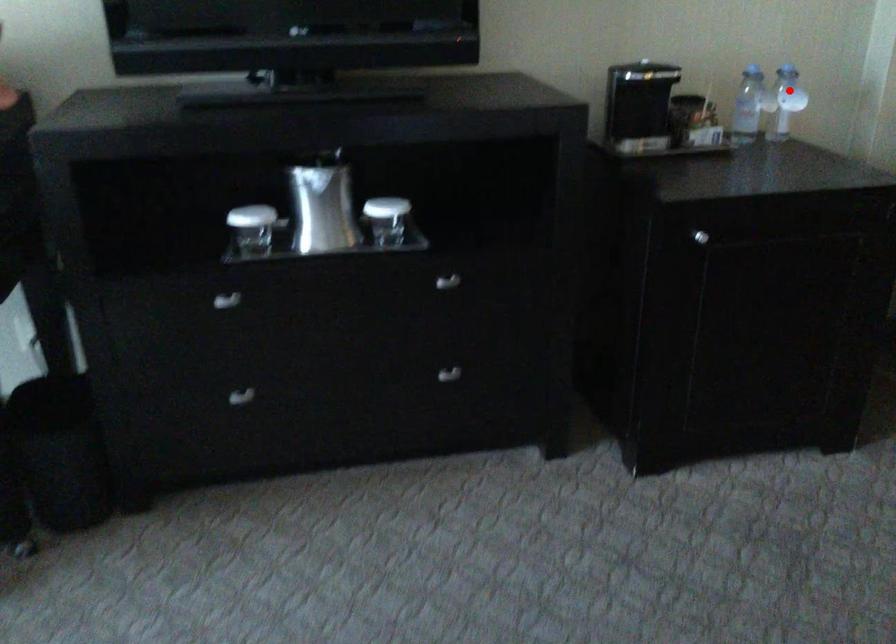
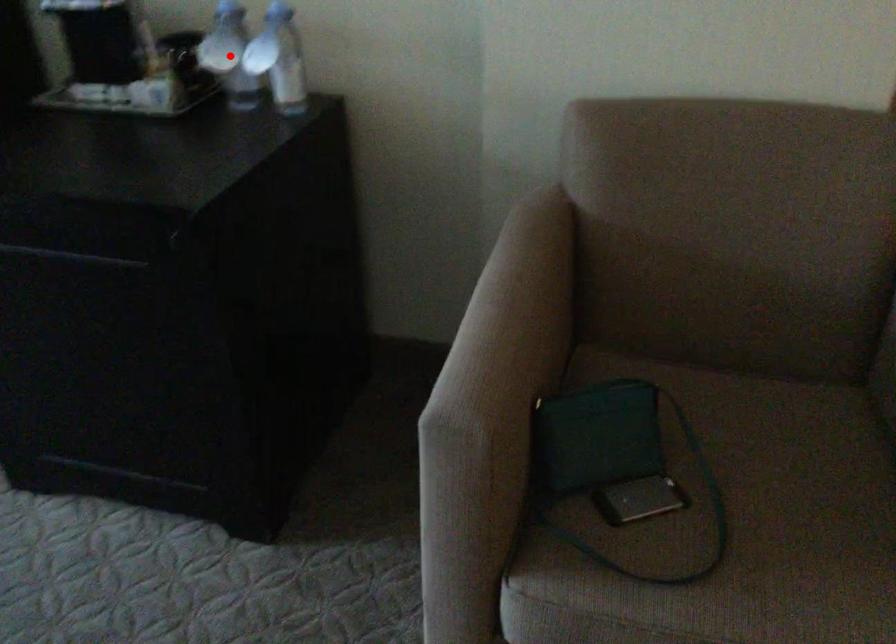
I am providing you with two images of the same scene from different viewpoints. A red point is marked on the first image and another point is marked on the second image. Is the red point in image1 aligned with the point shown in image2?

No